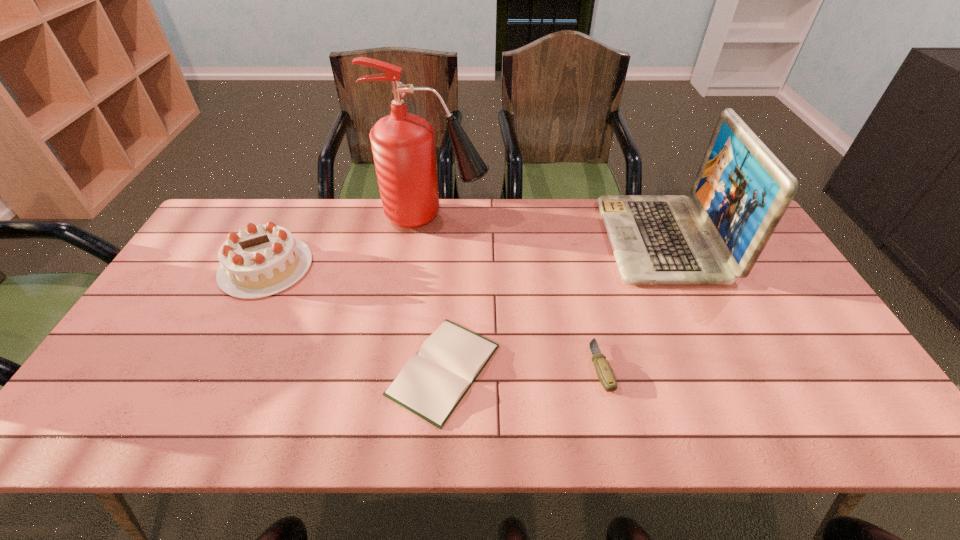
Identify the location of vacant space located on the screen of the fourth shortest object. The width and height of the screenshot is (960, 540). (555, 239).

Identify the location of vacant region located on the screen of the fourth shortest object. This screenshot has height=540, width=960. (558, 239).

Where is `free space located 0.180m on the back of the third tallest object`? This screenshot has height=540, width=960. free space located 0.180m on the back of the third tallest object is located at coordinates (297, 205).

Where is `vacant region located 0.100m on the right of the fourth object from left to right`? vacant region located 0.100m on the right of the fourth object from left to right is located at coordinates (651, 366).

Where is `free spot located on the right of the hardback book`? Image resolution: width=960 pixels, height=540 pixels. free spot located on the right of the hardback book is located at coordinates (603, 369).

Locate an element on the screen. fire extinguisher positioned at the far edge is located at coordinates (403, 145).

The width and height of the screenshot is (960, 540). What are the coordinates of `laptop computer located in the far edge section of the desktop` in the screenshot? It's located at (742, 190).

The width and height of the screenshot is (960, 540). What are the coordinates of `birthday cake that is at the far edge` in the screenshot? It's located at (263, 260).

The width and height of the screenshot is (960, 540). Identify the location of object that is at the near edge. (432, 383).

Locate an element on the screen. The image size is (960, 540). object at the left edge is located at coordinates point(263,260).